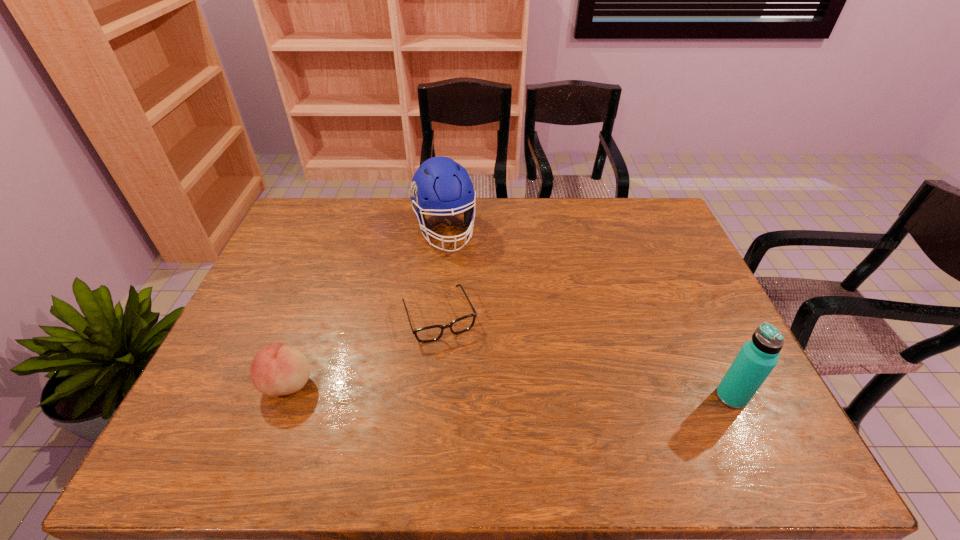
Image resolution: width=960 pixels, height=540 pixels. Identify the location of object that can be found as the second closest to the football helmet. (276, 370).

At what (x,y) coordinates should I click in order to perform the action: click on free space that satisfies the following two spatial constraints: 1. on the back side of the farthest object; 2. on the left side of the peach. Please return your answer as a coordinate pair (x, y). Looking at the image, I should click on (345, 230).